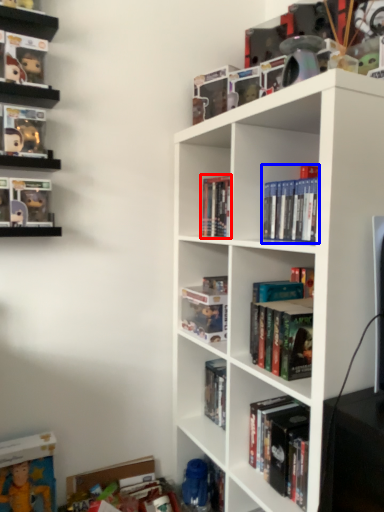
Question: Which of the following is the farthest to the observer, book (highlighted by a red box) or book (highlighted by a blue box)?

Choices:
 (A) book
 (B) book

Answer: (A)